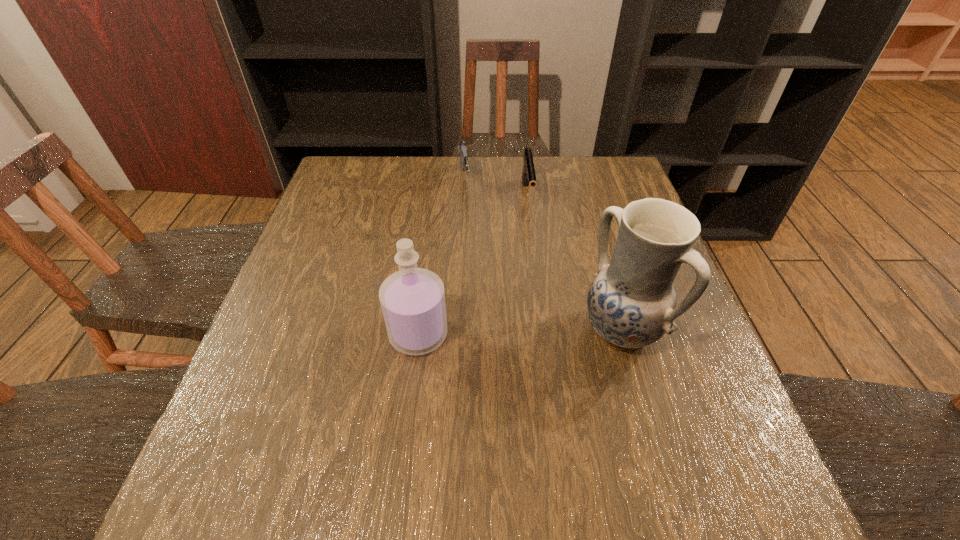
In the image, there is a desktop. Where is `vacant space at the near left corner`? This screenshot has height=540, width=960. vacant space at the near left corner is located at coordinates (259, 405).

Image resolution: width=960 pixels, height=540 pixels. In the image, there is a desktop. Identify the location of free region at the far right corner. (576, 174).

Find the location of a particular element. This screenshot has width=960, height=540. vacant space at the near right corner of the desktop is located at coordinates (657, 438).

Identify the location of blank region between the gun and the rightmost object. This screenshot has height=540, width=960. (542, 256).

The height and width of the screenshot is (540, 960). In order to click on vacant point located between the rightmost object and the second object from right to left in this screenshot , I will do `click(574, 262)`.

The height and width of the screenshot is (540, 960). Identify the location of blank region between the perfume and the pistol. (473, 266).

This screenshot has height=540, width=960. Find the location of `free space between the rightmost object and the pistol`. free space between the rightmost object and the pistol is located at coordinates (574, 262).

I want to click on blank region between the pistol and the pottery, so click(x=574, y=262).

Image resolution: width=960 pixels, height=540 pixels. I want to click on free spot between the gun and the second tallest object, so click(x=442, y=259).

Image resolution: width=960 pixels, height=540 pixels. Identify the location of free area in between the second tallest object and the third object from left to right. (473, 266).